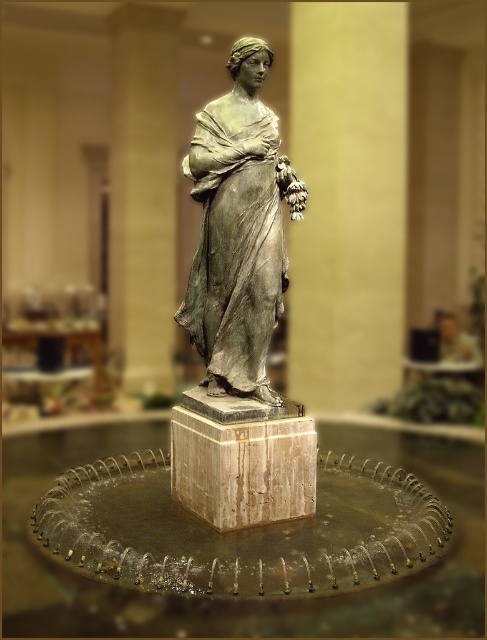
Question: Can you confirm if green patina bronze statue at center is smaller than marble pedestal at center?

Choices:
 (A) no
 (B) yes

Answer: (A)

Question: From the image, what is the correct spatial relationship of green patina bronze statue at center in relation to marble pedestal at center?

Choices:
 (A) above
 (B) below

Answer: (A)

Question: From the image, what is the correct spatial relationship of green patina bronze statue at center in relation to marble pedestal at center?

Choices:
 (A) right
 (B) left

Answer: (A)

Question: Which of the following is the closest to the observer?

Choices:
 (A) marble pedestal at center
 (B) green patina bronze statue at center

Answer: (A)